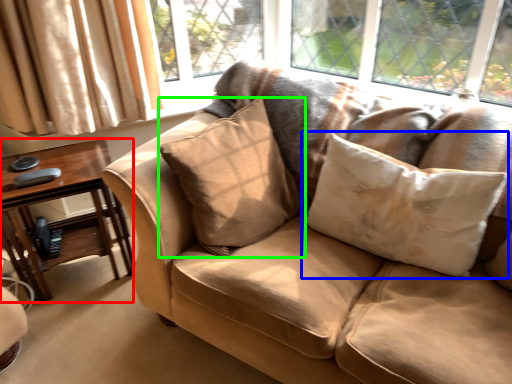
Question: Which is nearer to the table (highlighted by a red box)? pillow (highlighted by a blue box) or pillow (highlighted by a green box).

Choices:
 (A) pillow
 (B) pillow

Answer: (B)